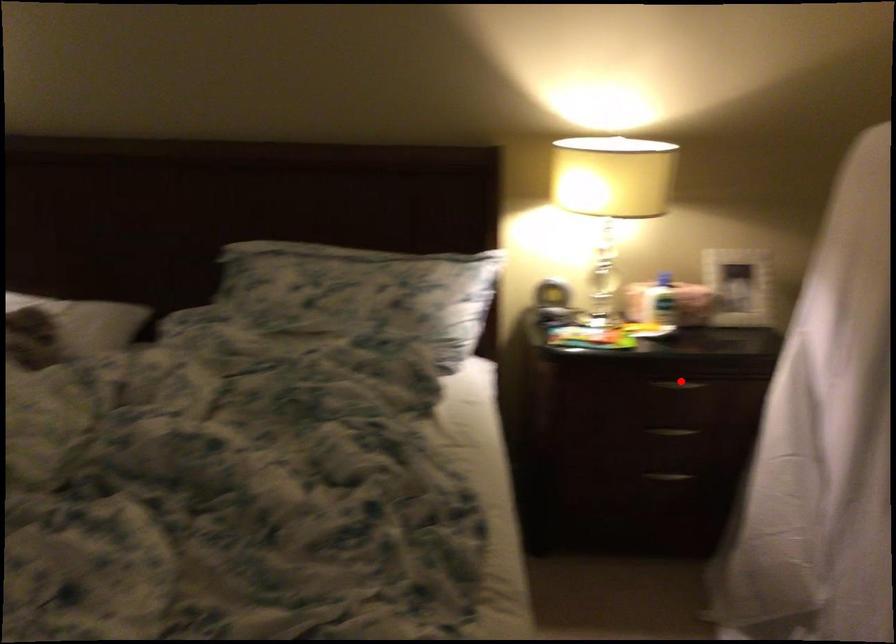
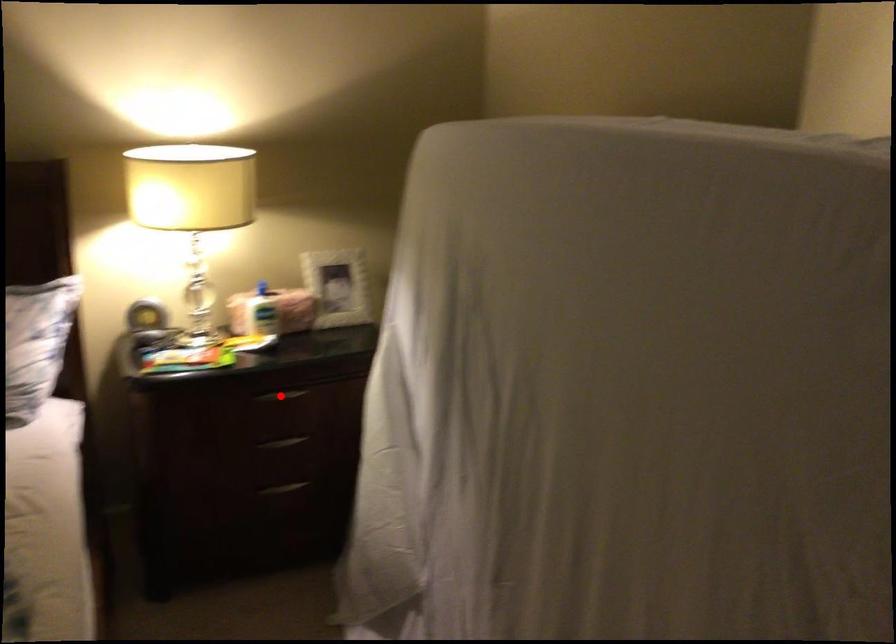
I am providing you with two images of the same scene from different viewpoints. A red point is marked on the first image and another point is marked on the second image. Does the point marked in image1 correspond to the same location as the one in image2?

Yes